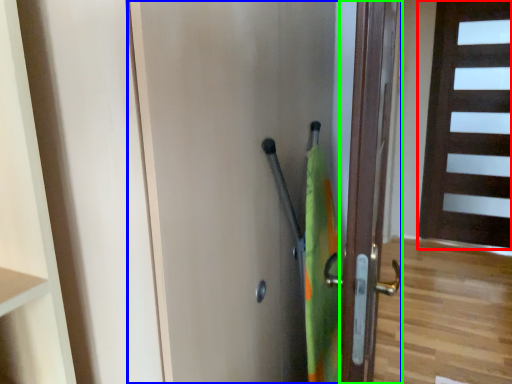
Question: Which object is the closest to the door (highlighted by a red box)? Choose among these: door (highlighted by a blue box) or door (highlighted by a green box).

Choices:
 (A) door
 (B) door

Answer: (B)